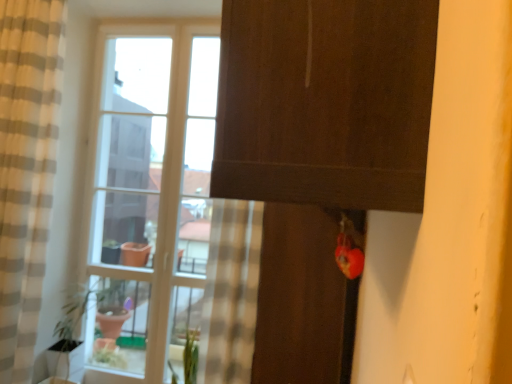
Question: In the image, is green matte plant at lower center positioned in front of or behind matte brown screen door at center?

Choices:
 (A) front
 (B) behind

Answer: (B)

Question: Considering the positions of point (188, 339) and point (309, 261), is point (188, 339) closer or farther from the camera than point (309, 261)?

Choices:
 (A) closer
 (B) farther

Answer: (B)

Question: Based on their relative distances, which object is farther from the beige striped curtain at left?

Choices:
 (A) matte brown screen door at center
 (B) clear glass vase at lower left
 (C) clear glass window at center
 (D) green matte plant at lower center

Answer: (A)

Question: Which is nearer to the beige striped curtain at left?

Choices:
 (A) matte brown screen door at center
 (B) clear glass vase at lower left
 (C) green matte plant at lower center
 (D) clear glass window at center

Answer: (B)